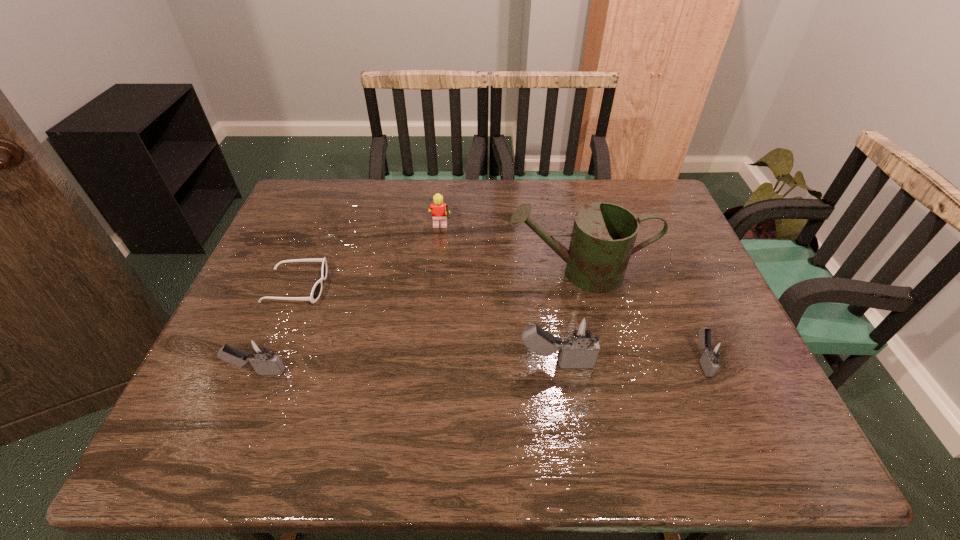
The width and height of the screenshot is (960, 540). I want to click on igniter that is at the right edge, so click(x=714, y=350).

The image size is (960, 540). I want to click on watering can that is at the right edge, so 603,236.

What are the coordinates of `object that is at the near left corner` in the screenshot? It's located at (258, 352).

This screenshot has width=960, height=540. I want to click on object that is at the near right corner, so (x=714, y=350).

I want to click on vacant space at the far edge, so tap(435, 180).

Image resolution: width=960 pixels, height=540 pixels. What are the coordinates of `free space at the near edge of the desktop` in the screenshot? It's located at [x=512, y=387].

In the image, there is a desktop. Where is `vacant region at the left edge`? The width and height of the screenshot is (960, 540). vacant region at the left edge is located at coordinates (249, 305).

Find the location of a particular element. The width and height of the screenshot is (960, 540). vacant area at the right edge is located at coordinates (715, 322).

Image resolution: width=960 pixels, height=540 pixels. Find the location of `free space at the far right corner of the desktop`. free space at the far right corner of the desktop is located at coordinates (655, 219).

Locate an element on the screen. This screenshot has height=540, width=960. vacant region at the near right corner is located at coordinates (727, 399).